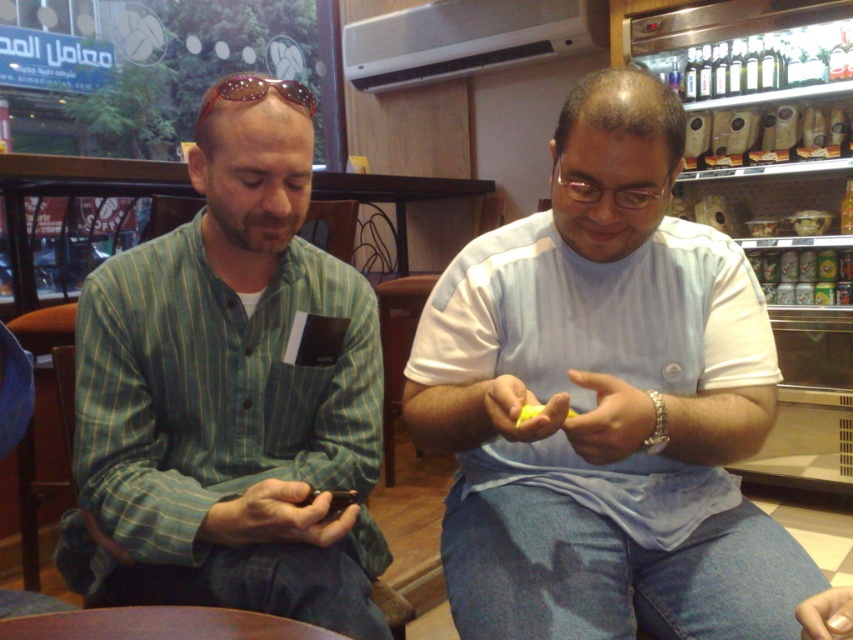
Who is shorter, green striped shirt at left or sunglasses at upper center?

sunglasses at upper center is shorter.

Which is in front, point (294, 502) or point (253, 84)?

Point (294, 502)

Locate an element on the screen. This screenshot has width=853, height=640. green striped shirt at left is located at coordinates pos(228,401).

Is light blue cotton shirt at center smaller than sunglasses at upper center?

No.

Does light blue cotton shirt at center appear on the right side of sunglasses at upper center?

Indeed, light blue cotton shirt at center is positioned on the right side of sunglasses at upper center.

Does point (456, 292) come behind point (259, 93)?

Yes, it is.

Locate an element on the screen. The width and height of the screenshot is (853, 640). light blue cotton shirt at center is located at coordinates (605, 403).

Does light blue cotton shirt at center appear on the right side of green striped shirt at left?

Correct, you'll find light blue cotton shirt at center to the right of green striped shirt at left.

Can you confirm if light blue cotton shirt at center is shorter than green striped shirt at left?

No.

Who is more forward, (x=729, y=296) or (x=218, y=307)?

Point (x=729, y=296) is in front.

Image resolution: width=853 pixels, height=640 pixels. Identify the location of light blue cotton shirt at center. (605, 403).